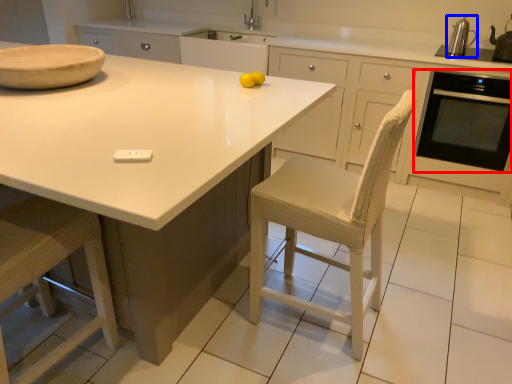
Question: Which object appears closest to the camera in this image, home appliance (highlighted by a red box) or kitchen appliance (highlighted by a blue box)?

Choices:
 (A) home appliance
 (B) kitchen appliance

Answer: (A)